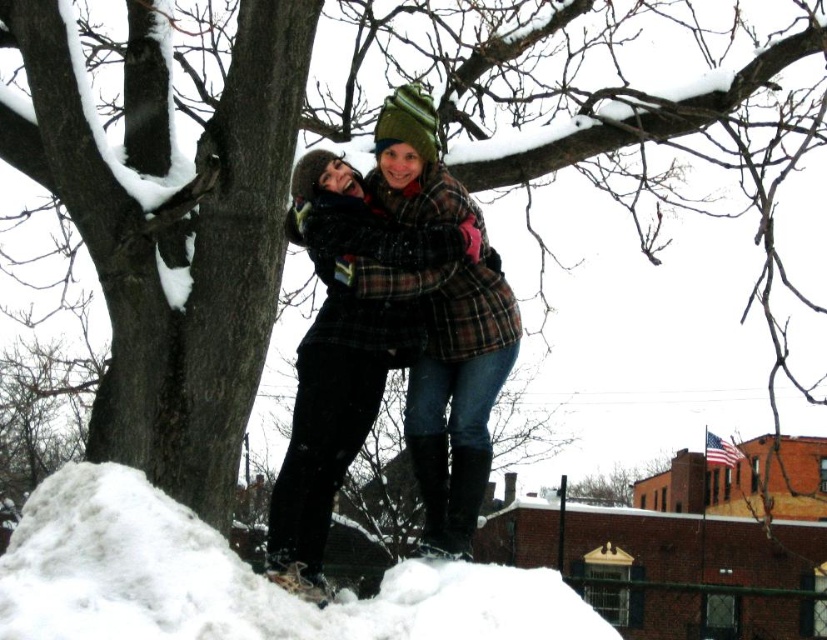
Question: Which point is farther to the camera?

Choices:
 (A) plaid wool coat at center
 (B) white fluffy snow at lower left

Answer: (A)

Question: Among these objects, which one is nearest to the camera?

Choices:
 (A) white fluffy snow at lower left
 (B) plaid wool coat at center

Answer: (A)

Question: Is white fluffy snow at lower left smaller than plaid wool coat at center?

Choices:
 (A) yes
 (B) no

Answer: (B)

Question: Where is white fluffy snow at lower left located in relation to plaid wool coat at center in the image?

Choices:
 (A) above
 (B) below

Answer: (B)

Question: Which point is farther to the camera?

Choices:
 (A) (471, 237)
 (B) (509, 584)

Answer: (A)

Question: Is white fluffy snow at lower left to the left of plaid wool coat at center from the viewer's perspective?

Choices:
 (A) yes
 (B) no

Answer: (A)